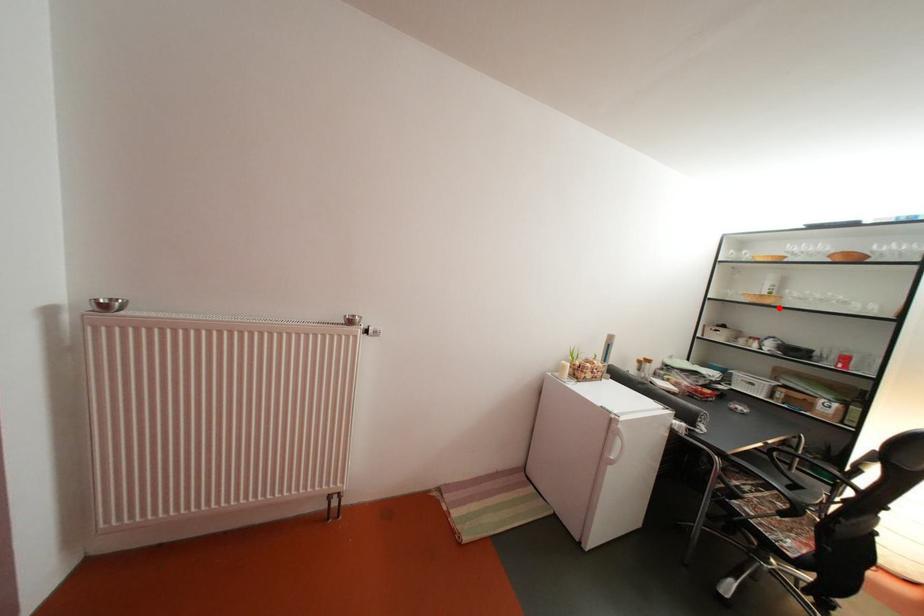
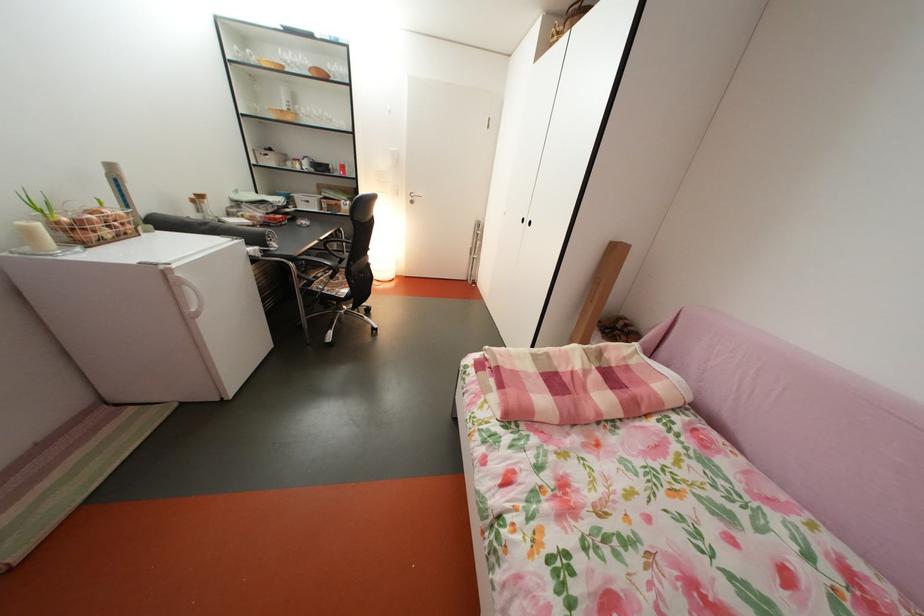
Find the pixel in the second image that matches the highlighted location in the first image.

(300, 124)